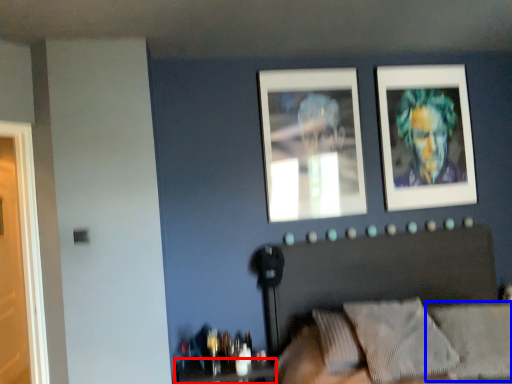
Question: Which object appears farthest to the camera in this image, table (highlighted by a red box) or pillow (highlighted by a blue box)?

Choices:
 (A) table
 (B) pillow

Answer: (A)